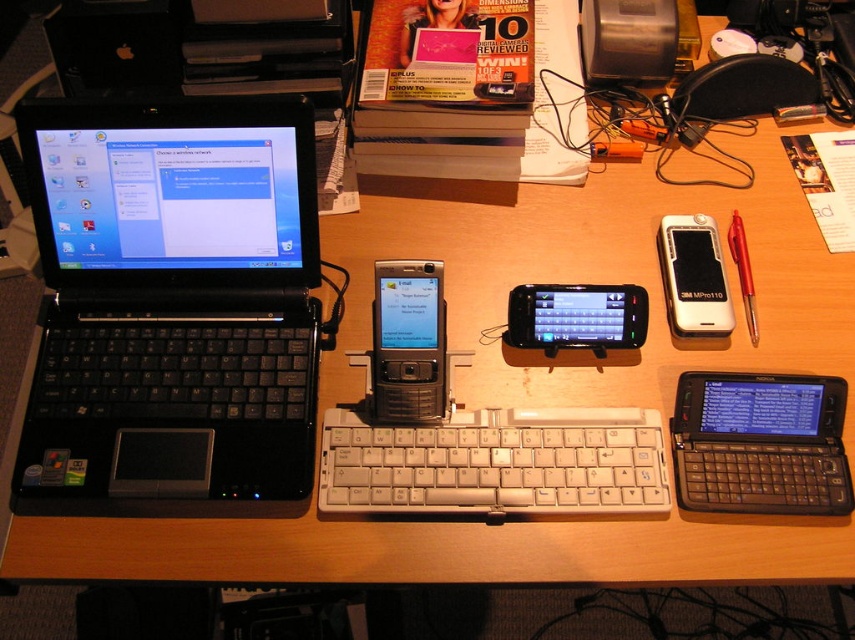
Which of these two, white plastic phone at center or red plastic pen at right, stands taller?

red plastic pen at right

Who is lower down, white plastic phone at center or red plastic pen at right?

white plastic phone at center

The width and height of the screenshot is (855, 640). What do you see at coordinates (693, 276) in the screenshot?
I see `white plastic phone at center` at bounding box center [693, 276].

In order to click on white plastic phone at center in this screenshot , I will do `click(693, 276)`.

Is white plastic keyboard at center closer to the viewer compared to metallic silver phone at center?

Yes, white plastic keyboard at center is in front of metallic silver phone at center.

Which is below, white plastic keyboard at center or metallic silver phone at center?

Positioned lower is white plastic keyboard at center.

Image resolution: width=855 pixels, height=640 pixels. Describe the element at coordinates (496, 461) in the screenshot. I see `white plastic keyboard at center` at that location.

What are the coordinates of `white plastic keyboard at center` in the screenshot? It's located at (496, 461).

Can you confirm if metallic silver phone at center is wider than black plastic smartphone at center?

Incorrect, metallic silver phone at center's width does not surpass black plastic smartphone at center's.

Can you confirm if metallic silver phone at center is thinner than black plastic smartphone at center?

Yes, metallic silver phone at center is thinner than black plastic smartphone at center.

Between point (401, 307) and point (573, 292), which one is positioned behind?

The point (573, 292) is more distant.

In order to click on metallic silver phone at center in this screenshot , I will do `click(408, 342)`.